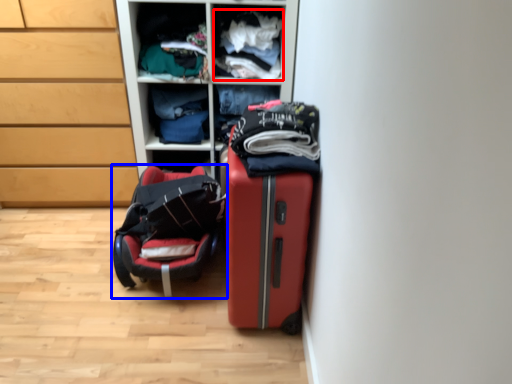
Question: Which object appears farthest to the camera in this image, clothing (highlighted by a red box) or luggage and bags (highlighted by a blue box)?

Choices:
 (A) clothing
 (B) luggage and bags

Answer: (A)